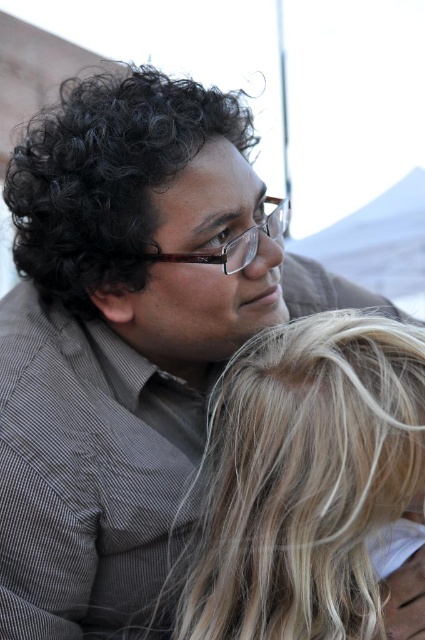
Question: Among these points, which one is farthest from the camera?

Choices:
 (A) (190, 561)
 (B) (30, 180)

Answer: (B)

Question: Can you confirm if blonde hair at center is positioned below black curly hair at upper left?

Choices:
 (A) yes
 (B) no

Answer: (A)

Question: Does blonde hair at center have a greater width compared to black curly hair at upper left?

Choices:
 (A) no
 (B) yes

Answer: (A)

Question: Which point appears farthest from the camera in this image?

Choices:
 (A) (283, 364)
 (B) (78, 163)

Answer: (B)

Question: Is blonde hair at center to the right of black curly hair at upper left from the viewer's perspective?

Choices:
 (A) yes
 (B) no

Answer: (A)